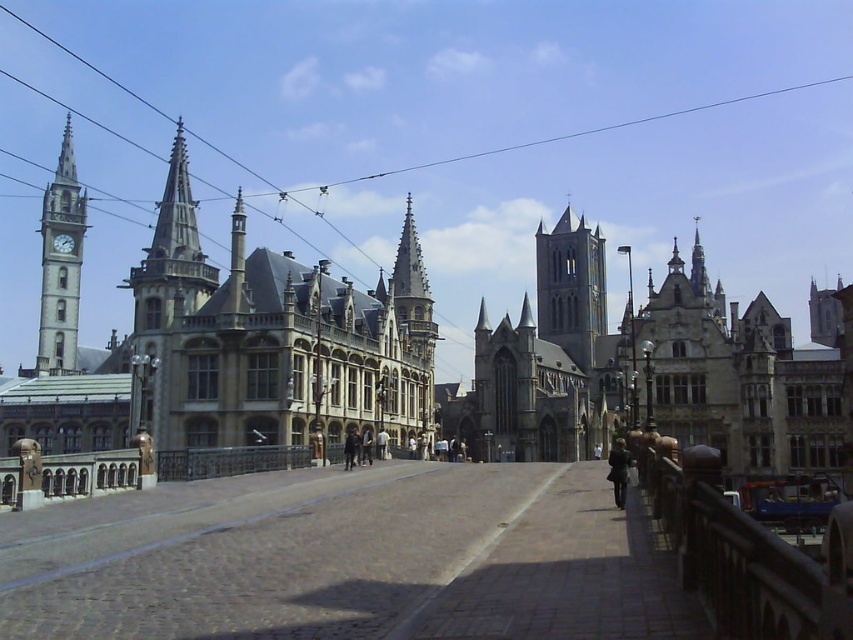
You are an architect visiting the city and need to measure the distance between the two matte gray clock structures. According to the scene, how far apart are the matte gray clock tower at left and the matte gray clock at left?

The matte gray clock tower at left is 9.11 meters away from the matte gray clock at left.

You are standing on a bridge overlooking a historic city. You notice two points marked in the scene. The first point is at coordinate point(582, 282) and the second is at point(415, 284). Which of these two points is closer to your current position on the bridge?

Point(582, 282) is closer to your current position on the bridge because it is further to the viewer than point(415, 284).

You are standing on a bridge overlooking a historic city. You notice the matte gray clock tower at left in the distance. If you want to take a closer look at the clock tower, should you walk towards the bridge or away from it?

Since the matte gray clock tower at left is 132.37 meters away from the viewer, you should walk towards the bridge to get closer to the clock tower.